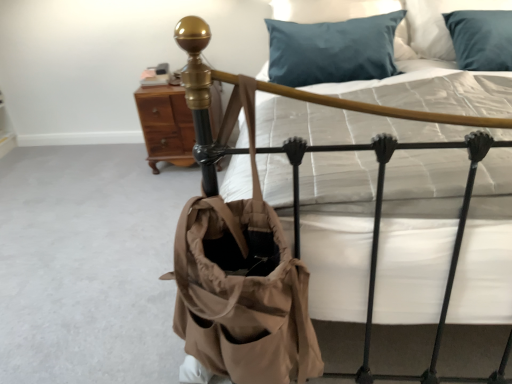
Locate an element on the screen. free spot in front of brown wood nightstand at upper left is located at coordinates (152, 189).